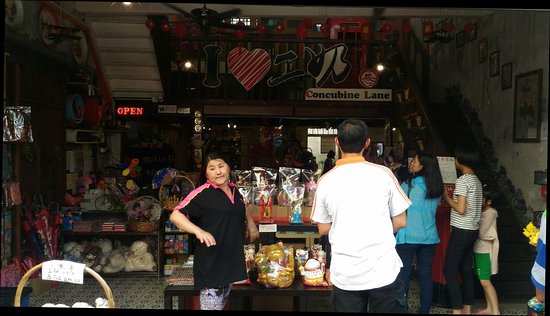
At what (x,y) coordinates should I click in order to perform the action: click on stuffed bears. Please return your answer as a coordinate pair (x, y). The width and height of the screenshot is (550, 316). Looking at the image, I should click on point(144,255), point(118,260), point(102,256).